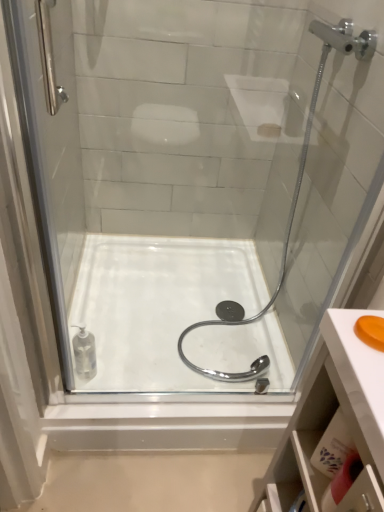
Question: Considering the relative sizes of orange matte soap at upper right and white glossy bath at center in the image provided, is orange matte soap at upper right taller than white glossy bath at center?

Choices:
 (A) no
 (B) yes

Answer: (A)

Question: Considering the relative sizes of orange matte soap at upper right and white glossy bath at center in the image provided, is orange matte soap at upper right thinner than white glossy bath at center?

Choices:
 (A) no
 (B) yes

Answer: (B)

Question: Is orange matte soap at upper right at the left side of white glossy bath at center?

Choices:
 (A) no
 (B) yes

Answer: (A)

Question: Does orange matte soap at upper right touch white glossy bath at center?

Choices:
 (A) yes
 (B) no

Answer: (B)

Question: From the image's perspective, is orange matte soap at upper right beneath white glossy bath at center?

Choices:
 (A) no
 (B) yes

Answer: (A)

Question: Is the position of orange matte soap at upper right more distant than that of white glossy bath at center?

Choices:
 (A) yes
 (B) no

Answer: (B)

Question: Is white glossy bath at center facing away from orange matte soap at upper right?

Choices:
 (A) no
 (B) yes

Answer: (A)

Question: Does white glossy bath at center appear on the left side of orange matte soap at upper right?

Choices:
 (A) no
 (B) yes

Answer: (B)

Question: Considering the relative sizes of white glossy bath at center and orange matte soap at upper right in the image provided, is white glossy bath at center smaller than orange matte soap at upper right?

Choices:
 (A) no
 (B) yes

Answer: (A)

Question: Is white glossy bath at center far from orange matte soap at upper right?

Choices:
 (A) yes
 (B) no

Answer: (A)

Question: Does white glossy bath at center have a greater height compared to orange matte soap at upper right?

Choices:
 (A) no
 (B) yes

Answer: (B)

Question: Is white glossy bath at center oriented towards orange matte soap at upper right?

Choices:
 (A) no
 (B) yes

Answer: (A)

Question: From the image's perspective, relative to white glossy bath at center, is orange matte soap at upper right above or below?

Choices:
 (A) above
 (B) below

Answer: (A)